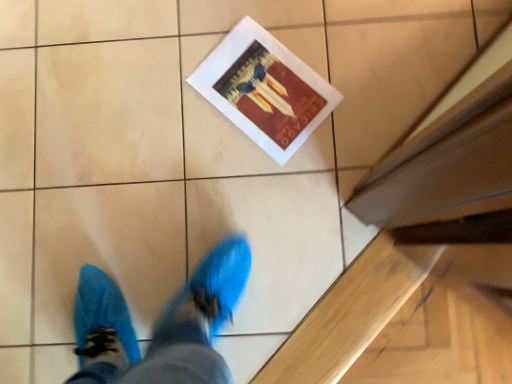
Find the location of a particular element. This screenshot has height=384, width=512. vacant area that is in front of matte paper postcard at center is located at coordinates (287, 180).